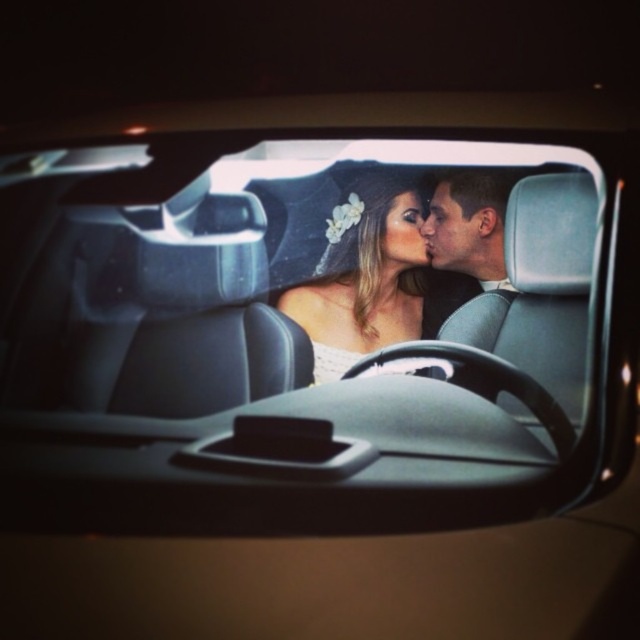
Which of these two, white satin dress at center or matte black hair at center, stands taller?

white satin dress at center is taller.

Who is positioned more to the left, white satin dress at center or matte black hair at center?

Positioned to the left is white satin dress at center.

Find the location of a particular element. white satin dress at center is located at coordinates (364, 276).

The height and width of the screenshot is (640, 640). Identify the location of white satin dress at center. (364, 276).